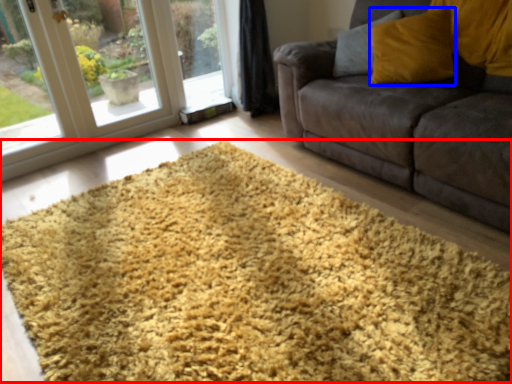
Question: Among these objects, which one is farthest to the camera, hay (highlighted by a red box) or throw pillow (highlighted by a blue box)?

Choices:
 (A) hay
 (B) throw pillow

Answer: (B)